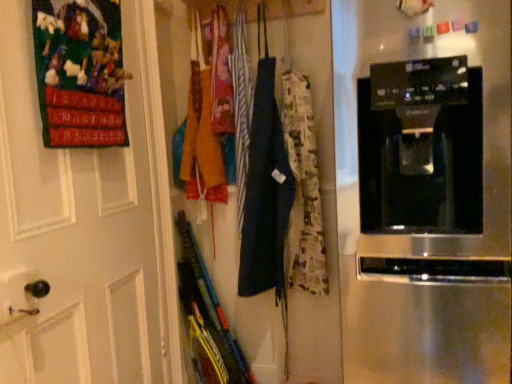
Question: Considering the relative positions of printed fabric apron at center and black glossy coffee maker at center in the image provided, is printed fabric apron at center to the left of black glossy coffee maker at center from the viewer's perspective?

Choices:
 (A) yes
 (B) no

Answer: (A)

Question: Considering the relative sizes of printed fabric apron at center and black glossy coffee maker at center in the image provided, is printed fabric apron at center taller than black glossy coffee maker at center?

Choices:
 (A) yes
 (B) no

Answer: (B)

Question: Is printed fabric apron at center bigger than black glossy coffee maker at center?

Choices:
 (A) yes
 (B) no

Answer: (B)

Question: Is printed fabric apron at center facing towards black glossy coffee maker at center?

Choices:
 (A) yes
 (B) no

Answer: (B)

Question: Does printed fabric apron at center have a smaller size compared to black glossy coffee maker at center?

Choices:
 (A) no
 (B) yes

Answer: (B)

Question: Which is correct: dark blue fabric apron at center is inside black glossy coffee maker at center, or outside of it?

Choices:
 (A) inside
 (B) outside

Answer: (B)

Question: Considering the positions of dark blue fabric apron at center and black glossy coffee maker at center in the image, is dark blue fabric apron at center bigger or smaller than black glossy coffee maker at center?

Choices:
 (A) small
 (B) big

Answer: (A)

Question: Is dark blue fabric apron at center taller or shorter than black glossy coffee maker at center?

Choices:
 (A) short
 (B) tall

Answer: (B)

Question: Considering their positions, is dark blue fabric apron at center located in front of or behind black glossy coffee maker at center?

Choices:
 (A) behind
 (B) front

Answer: (A)

Question: Considering the positions of point (481, 150) and point (225, 44), is point (481, 150) closer or farther from the camera than point (225, 44)?

Choices:
 (A) farther
 (B) closer

Answer: (B)

Question: In terms of width, does black glossy coffee maker at center look wider or thinner when compared to printed fabric apron at center?

Choices:
 (A) wide
 (B) thin

Answer: (A)

Question: From a real-world perspective, is black glossy coffee maker at center physically located above or below printed fabric apron at center?

Choices:
 (A) above
 (B) below

Answer: (B)

Question: Looking at the image, does black glossy coffee maker at center seem bigger or smaller compared to printed fabric apron at center?

Choices:
 (A) big
 (B) small

Answer: (A)

Question: Considering the positions of dark blue fabric apron at center and printed fabric apron at center in the image, is dark blue fabric apron at center bigger or smaller than printed fabric apron at center?

Choices:
 (A) small
 (B) big

Answer: (B)

Question: From a real-world perspective, is dark blue fabric apron at center physically located above or below printed fabric apron at center?

Choices:
 (A) above
 (B) below

Answer: (B)